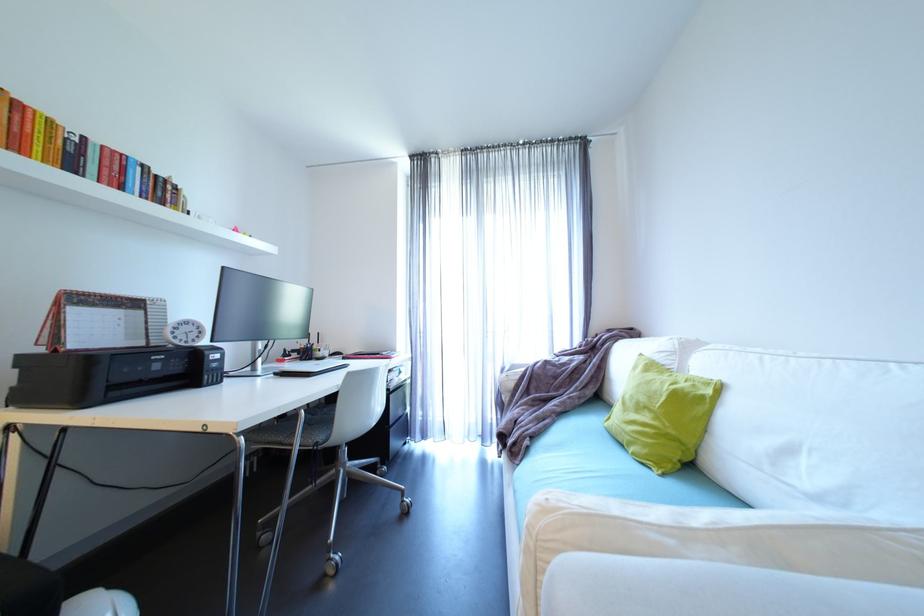
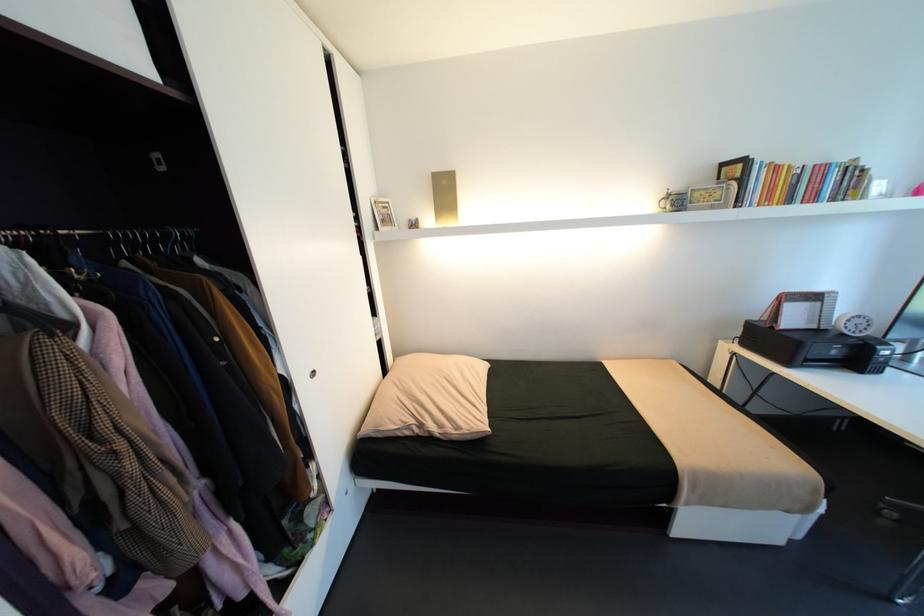
The point at (185, 347) is marked in the first image. Where is the corresponding point in the second image?

(850, 334)